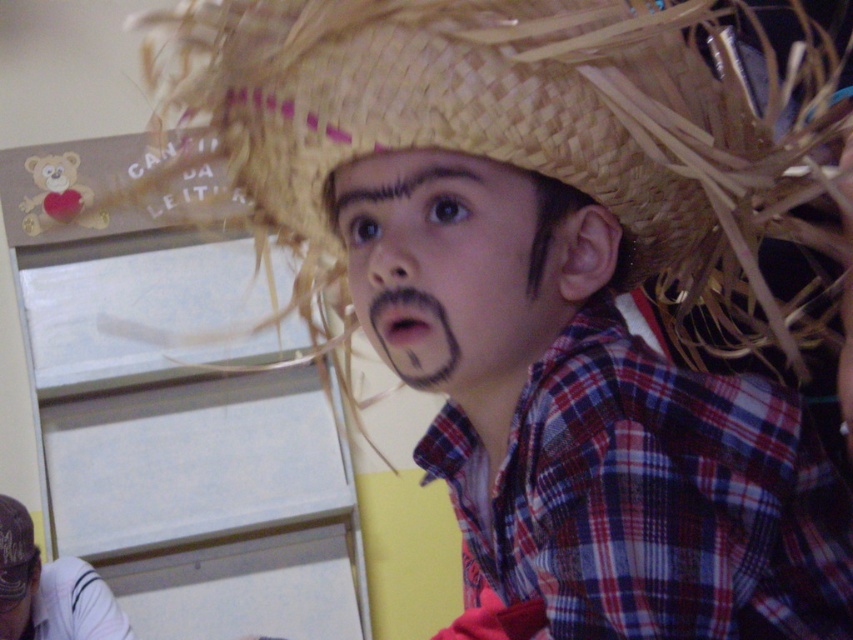
Question: Which is nearer to the woven straw hat at upper center?

Choices:
 (A) matte straw hat at center
 (B) black hair at upper center

Answer: (B)

Question: Which point appears closest to the camera in this image?

Choices:
 (A) (418, 168)
 (B) (368, 246)

Answer: (A)

Question: Does white striped shirt at lower left have a greater width compared to black hair at upper center?

Choices:
 (A) yes
 (B) no

Answer: (A)

Question: Is matte straw hat at center smaller than woven straw hat at upper center?

Choices:
 (A) yes
 (B) no

Answer: (A)

Question: Which object is closer to the camera taking this photo?

Choices:
 (A) black hair at upper center
 (B) woven straw hat at upper center
 (C) black matte nose at center
 (D) white striped shirt at lower left

Answer: (C)

Question: Is black matte nose at center positioned before woven straw hat at upper center?

Choices:
 (A) yes
 (B) no

Answer: (A)